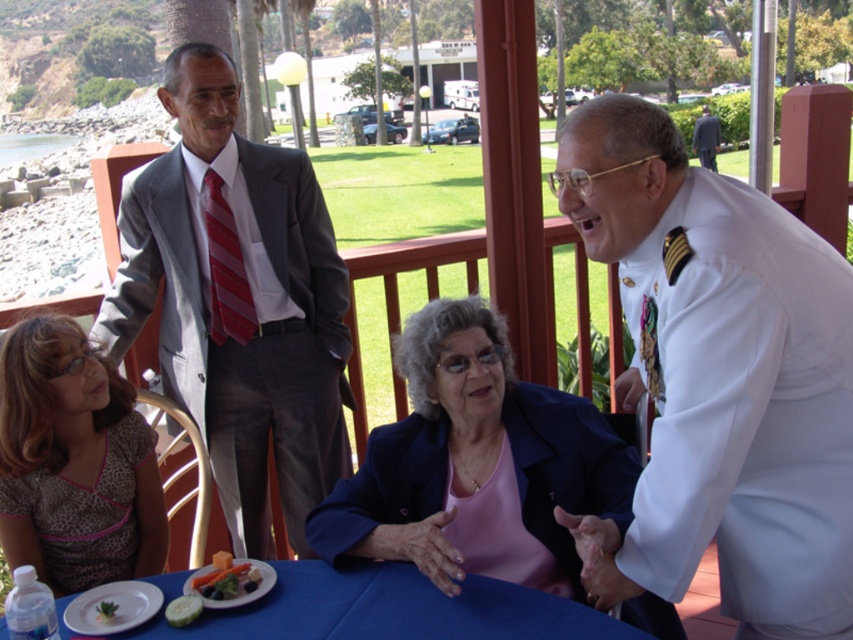
Identify the location of fresh green broccoli at table center. (235, 584).

Who is higher up, fresh green broccoli at table center or green leafy vegetable at table?

fresh green broccoli at table center is higher up.

Which is in front, point (271, 580) or point (117, 608)?

Point (117, 608)

I want to click on fresh green broccoli at table center, so click(235, 584).

Which is below, gray suit at left or striped fabric tie at upper center?

gray suit at left is below.

Consider the image. Is gray suit at left to the left of striped fabric tie at upper center from the viewer's perspective?

No, gray suit at left is not to the left of striped fabric tie at upper center.

Is point (338, 404) positioned after point (241, 305)?

Yes, point (338, 404) is behind point (241, 305).

Where is `gray suit at left`? The width and height of the screenshot is (853, 640). gray suit at left is located at coordinates (238, 301).

Between white uniform at center and matte blue blazer at center, which one appears on the right side from the viewer's perspective?

white uniform at center is more to the right.

Is white uniform at center smaller than matte blue blazer at center?

Correct, white uniform at center occupies less space than matte blue blazer at center.

Between point (618, 381) and point (368, 532), which one is positioned in front?

Point (368, 532) is more forward.

Locate an element on the screen. This screenshot has height=640, width=853. white uniform at center is located at coordinates (721, 376).